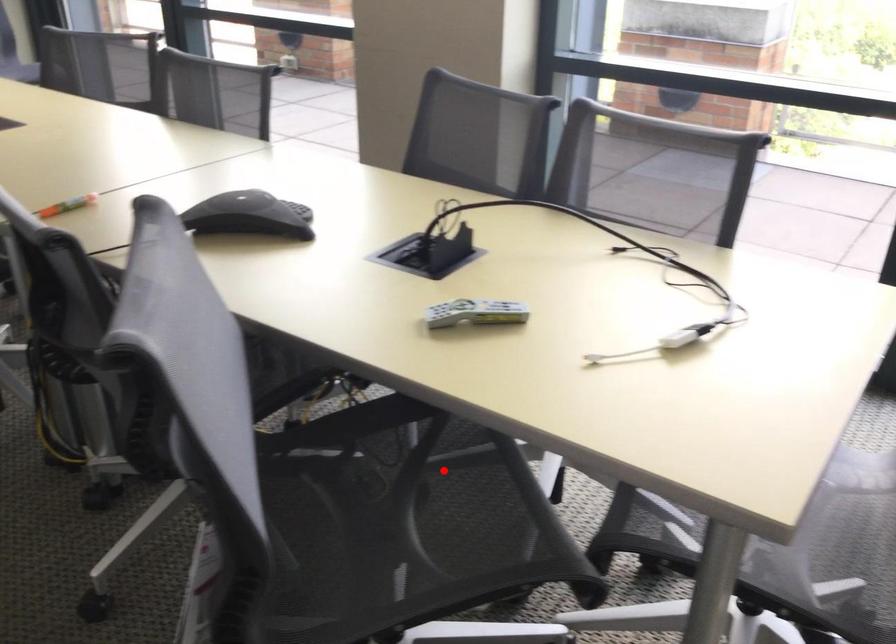
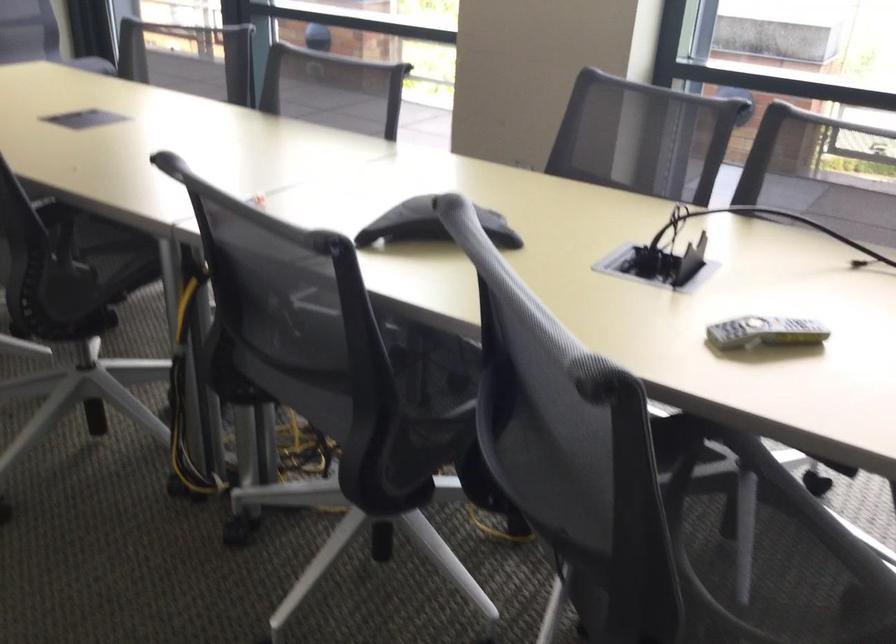
Question: I am providing you with two images of the same scene from different viewpoints. A red point is shown in image1. For the corresponding object point in image2, is it positioned nearer or farther from the camera?

Choices:
 (A) Nearer
 (B) Farther

Answer: (A)